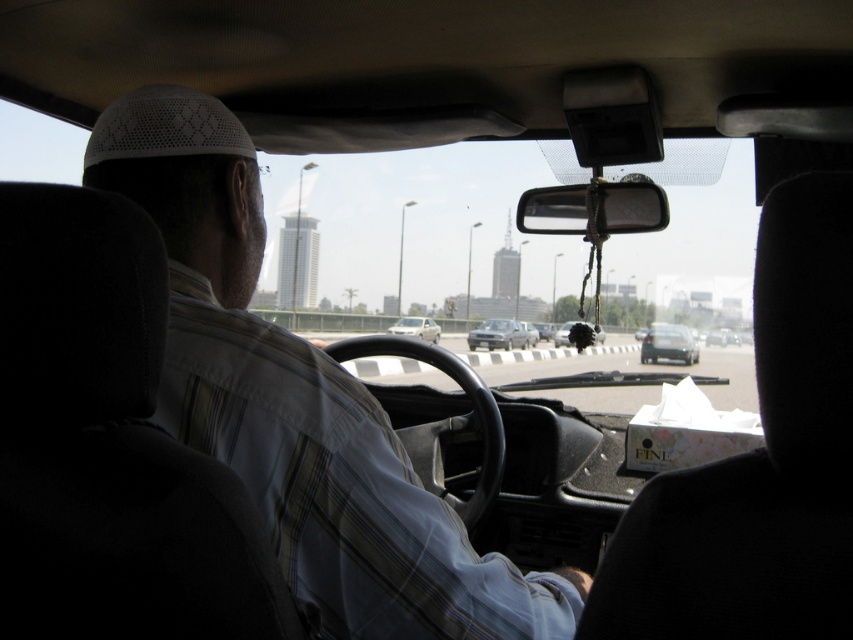
You are sitting in the backseat of the car and want to reach two points marked in the image. Which point, point (x=370, y=445) or point (x=682, y=328), is closer to you?

Point (x=370, y=445) is closer to the camera than point (x=682, y=328), so it is closer to you.

In the scene shown: You are a passenger sitting in the backseat of the car. You notice the light brown striped shirt at center and the matte black car at center. Which object appears larger in size?

The matte black car at center appears larger in size compared to the light brown striped shirt at center because the light brown striped shirt at center has a smaller size compared to matte black car at center.

You are a passenger in the backseat of a car. You notice the transparent glass windshield at center and the shiny black car at center. Which object is wider from your perspective?

The transparent glass windshield at center is wider than the shiny black car at center.